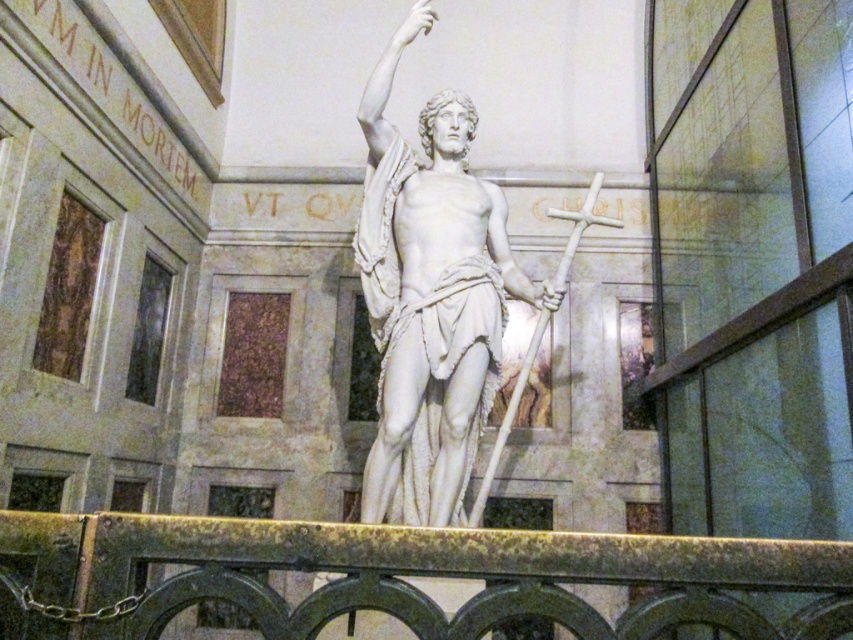
Who is taller, rusty metal railing at lower center or white marble statue at center?

white marble statue at center is taller.

Locate an element on the screen. The image size is (853, 640). rusty metal railing at lower center is located at coordinates (399, 573).

I want to click on rusty metal railing at lower center, so click(399, 573).